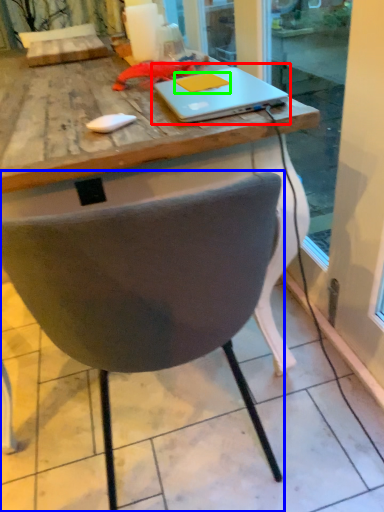
Question: Based on their relative distances, which object is farther from laptop (highlighted by a red box)? Choose from chair (highlighted by a blue box) and notepad (highlighted by a green box).

Choices:
 (A) chair
 (B) notepad

Answer: (A)